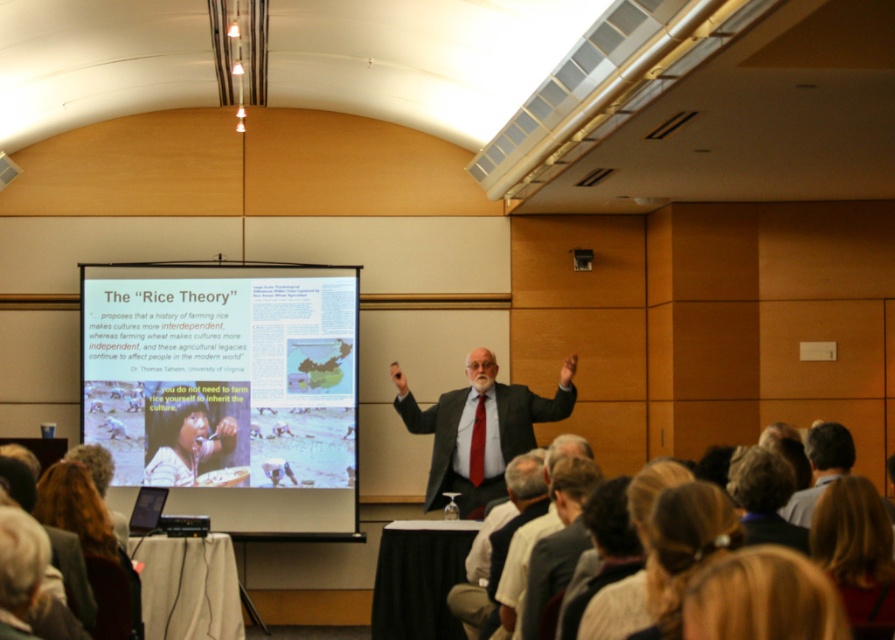
You are an attendee at this presentation and want to take a photo of the speaker. The speaker is wearing a dark gray suit at center and has blonde hair at upper right. Which object should you focus on to ensure the speaker is fully captured in your photo?

You should focus on the dark gray suit at center because it is larger in size than the blonde hair at upper right, indicating it is the main part of the speaker.

You are an attendee at the presentation and want to focus on the presenter. Which object should you look at first, the dark gray suit at center or the dark brown hair at upper center?

You should look at the dark brown hair at upper center first because the dark gray suit at center is below it, meaning the dark brown hair at upper center is higher up.